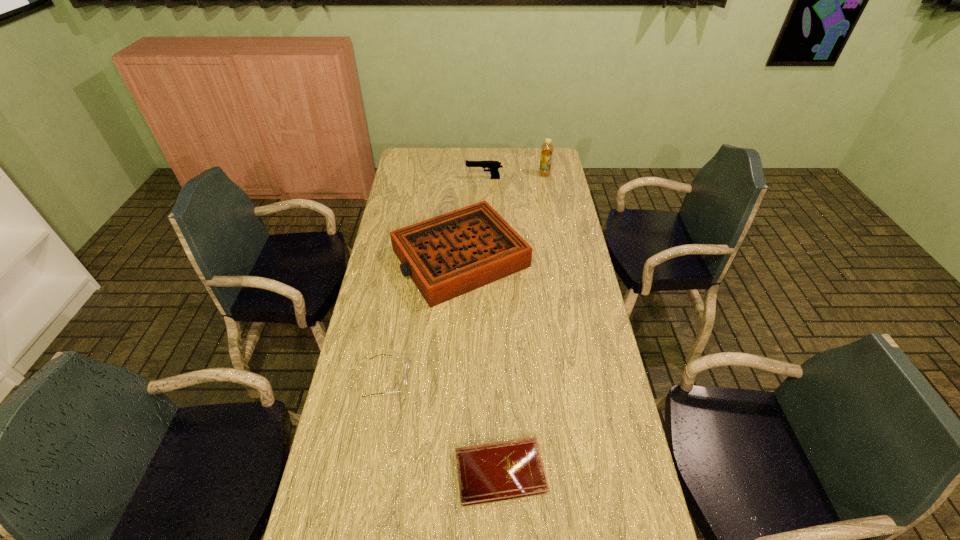
Find the location of `free point between the bottle and the pistol`. free point between the bottle and the pistol is located at coordinates (515, 177).

Where is `free space between the tallest object and the notebook`? free space between the tallest object and the notebook is located at coordinates (522, 323).

You are a GUI agent. You are given a task and a screenshot of the screen. Output one action in this format:
    pyautogui.click(x=<x>, y=<y>)
    Task: Click on the object that is the second nearest to the shortest object
    
    Given the screenshot: What is the action you would take?
    pyautogui.click(x=449, y=255)

Locate an element on the screen. This screenshot has width=960, height=540. object that stands as the closest to the pistol is located at coordinates (547, 148).

This screenshot has height=540, width=960. In order to click on blank space that satisfies the following two spatial constraints: 1. on the front side of the third farthest object; 2. on the left side of the shortest object in this screenshot , I will do [x=450, y=471].

Where is `free point that satisfies the following two spatial constraints: 1. on the back side of the notebook; 2. on the front-facing side of the pistol`? The height and width of the screenshot is (540, 960). free point that satisfies the following two spatial constraints: 1. on the back side of the notebook; 2. on the front-facing side of the pistol is located at coordinates (491, 178).

Where is `vacant space that satisfies the following two spatial constraints: 1. through the lenses of the second shortest object; 2. on the left side of the notebook`? The height and width of the screenshot is (540, 960). vacant space that satisfies the following two spatial constraints: 1. through the lenses of the second shortest object; 2. on the left side of the notebook is located at coordinates (372, 471).

Find the location of a particular element. The width and height of the screenshot is (960, 540). free space in the image that satisfies the following two spatial constraints: 1. through the lenses of the second nearest object; 2. on the right side of the notebook is located at coordinates (372, 471).